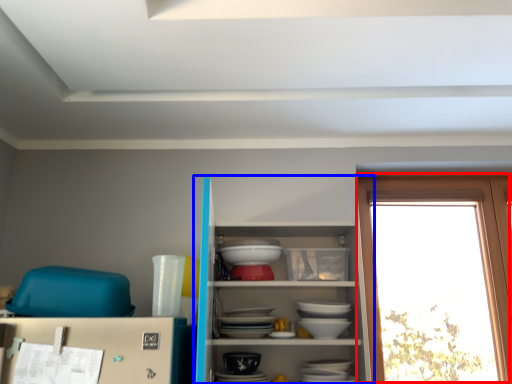
Question: Which of the following is the closest to the observer, window (highlighted by a red box) or shelf (highlighted by a blue box)?

Choices:
 (A) window
 (B) shelf

Answer: (B)